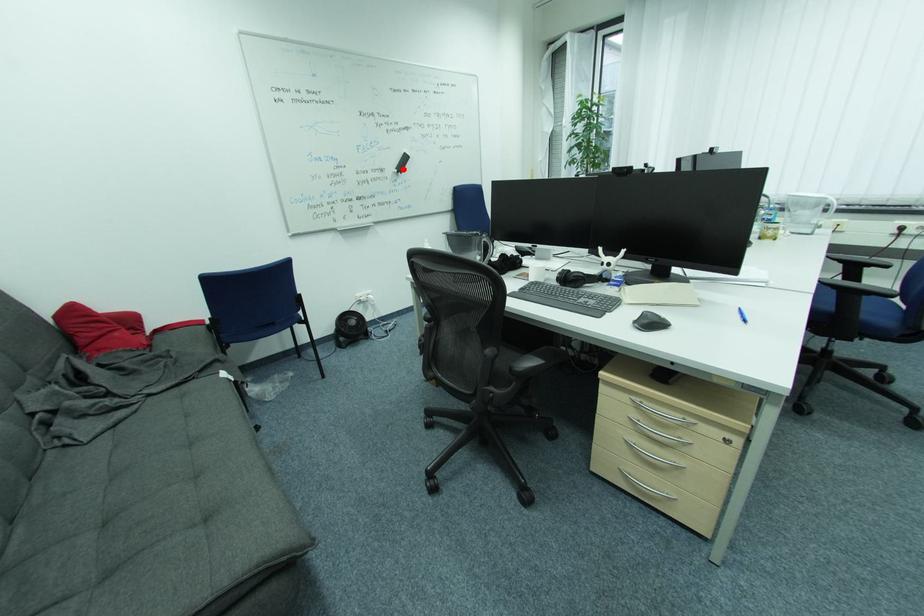
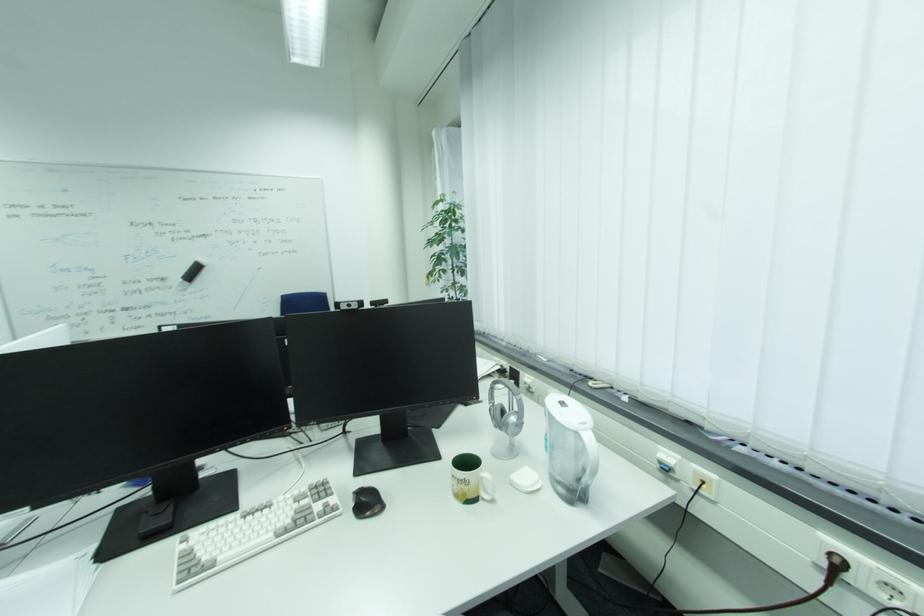
Question: I am providing you with two images of the same scene from different viewpoints. Given a red point in image1, look at the same physical point in image2. Is it:

Choices:
 (A) Closer to the viewpoint
 (B) Farther from the viewpoint

Answer: (B)